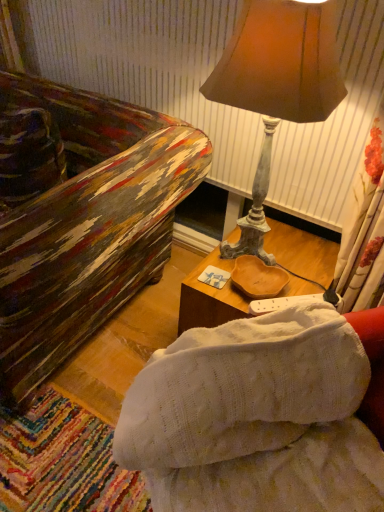
Image resolution: width=384 pixels, height=512 pixels. Identify the location of vacant space in matte brown lampshade at upper right (from a real-world perspective). (256, 257).